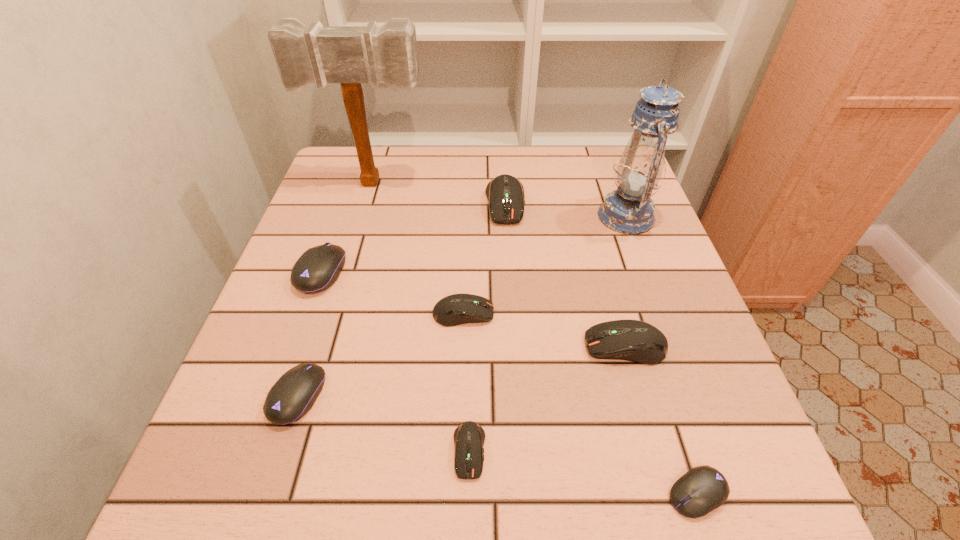
Image resolution: width=960 pixels, height=540 pixels. Find the location of `free space located 0.340m on the button of the third farthest dark computer equipment`. free space located 0.340m on the button of the third farthest dark computer equipment is located at coordinates (400, 346).

This screenshot has width=960, height=540. What are the coordinates of `vacant space located on the button of the third farthest dark computer equipment` in the screenshot? It's located at (470, 346).

At what (x,y) coordinates should I click in order to perform the action: click on vacant space located on the right of the sixth nearest object. Please return your answer as a coordinate pair (x, y). Looking at the image, I should click on (395, 272).

Where is `free space located 0.190m on the button of the second farthest dark computer equipment`? Image resolution: width=960 pixels, height=540 pixels. free space located 0.190m on the button of the second farthest dark computer equipment is located at coordinates (590, 314).

At what (x,y) coordinates should I click in order to perform the action: click on vacant space located 0.330m on the back of the second farthest black computer mouse. Please return your answer as a coordinate pair (x, y). Looking at the image, I should click on (347, 242).

Identify the location of vacant area located on the left of the nearest black computer mouse. (423, 494).

Locate an element on the screen. The height and width of the screenshot is (540, 960). mallet that is at the far edge is located at coordinates (350, 55).

The image size is (960, 540). I want to click on computer equipment that is positioned at the far edge, so click(505, 193).

You are a GUI agent. You are given a task and a screenshot of the screen. Output one action in this format:
    pyautogui.click(x=<x>, y=<y>)
    Task: Click on the mallet present at the left edge
    
    Given the screenshot: What is the action you would take?
    pyautogui.click(x=350, y=55)

At what (x,y) coordinates should I click in order to perform the action: click on lantern that is at the right edge. Please return your answer as a coordinate pair (x, y). This screenshot has width=960, height=540. Looking at the image, I should click on (629, 210).